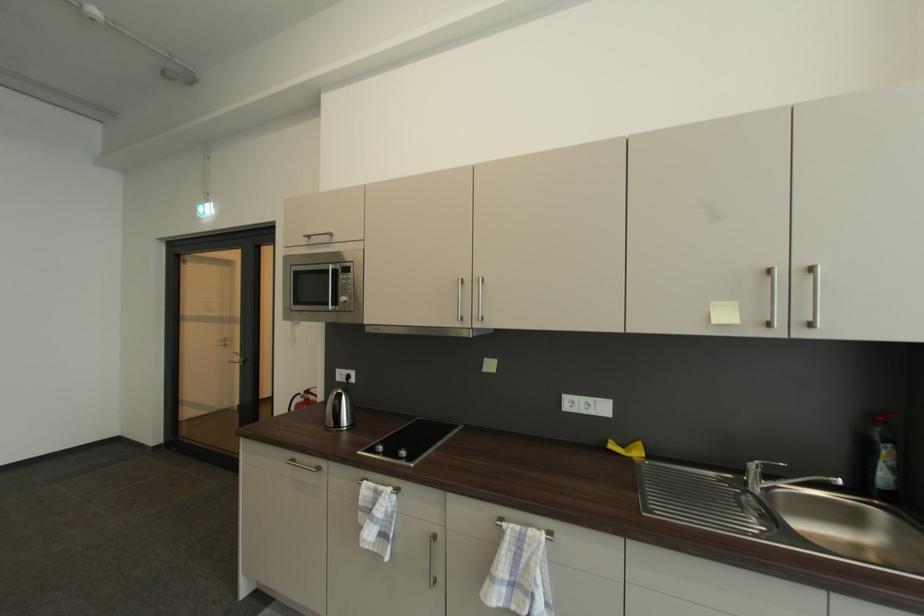
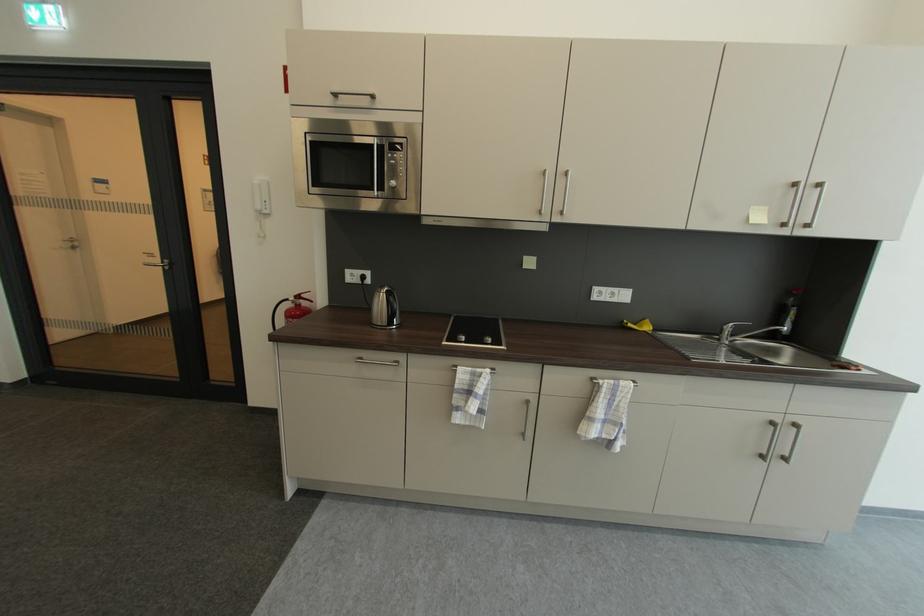
The point at (334,306) is marked in the first image. Where is the corresponding point in the second image?

(380, 191)